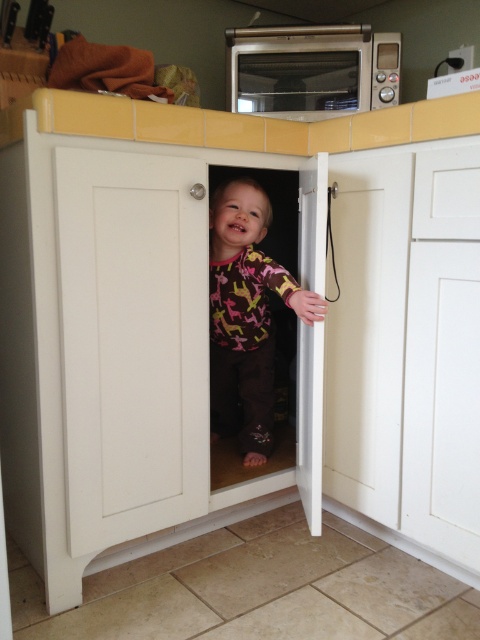
Question: Which is nearer to the white matte cabinet door at center?

Choices:
 (A) multicolored fabric baby at center
 (B) satin silver microwave at upper center

Answer: (A)

Question: Can you confirm if white matte cabinet door at center is smaller than satin silver microwave at upper center?

Choices:
 (A) yes
 (B) no

Answer: (B)

Question: Which is farther from the white matte cabinet door at center?

Choices:
 (A) satin silver microwave at upper center
 (B) multicolored fabric baby at center

Answer: (A)

Question: Is white matte cabinet door at center to the left of satin silver microwave at upper center from the viewer's perspective?

Choices:
 (A) no
 (B) yes

Answer: (B)

Question: Estimate the real-world distances between objects in this image. Which object is farther from the multicolored fabric baby at center?

Choices:
 (A) white matte cabinet door at center
 (B) satin silver microwave at upper center

Answer: (B)

Question: Where is white matte cabinet door at center located in relation to multicolored fabric baby at center in the image?

Choices:
 (A) left
 (B) right

Answer: (A)